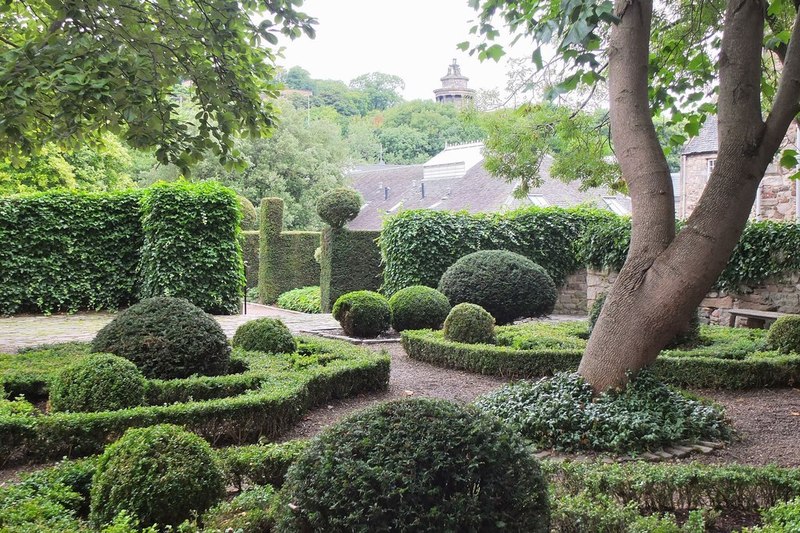
What are the coordinates of `window` in the screenshot? It's located at (709, 163).